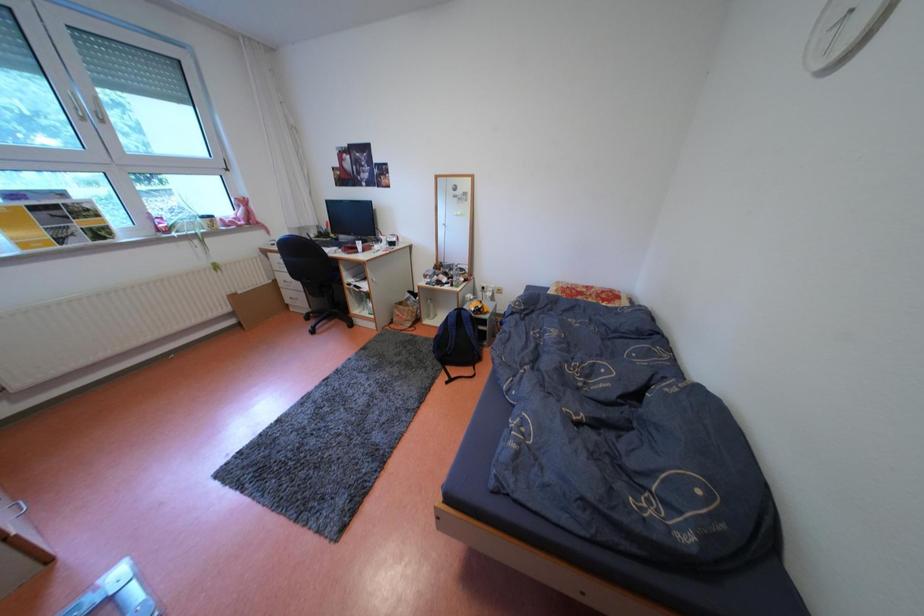
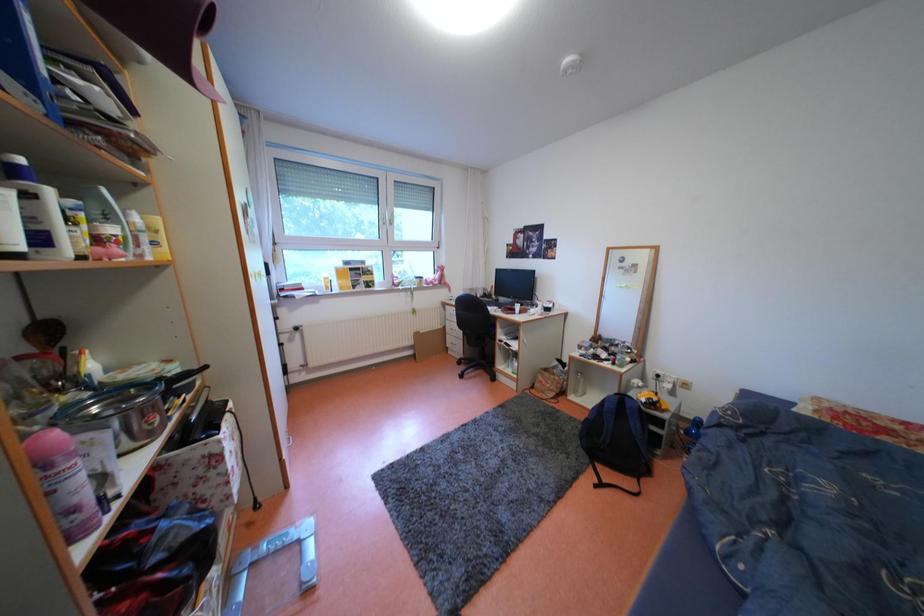
Question: Based on the continuous images, in which direction is the camera rotating? Reply with the corresponding letter.

Choices:
 (A) Left
 (B) Right
 (C) Up
 (D) Down

Answer: (A)